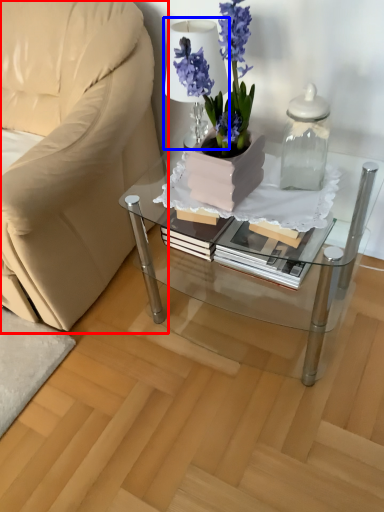
Question: Among these objects, which one is nearest to the camera, chair (highlighted by a red box) or table lamp (highlighted by a blue box)?

Choices:
 (A) chair
 (B) table lamp

Answer: (A)